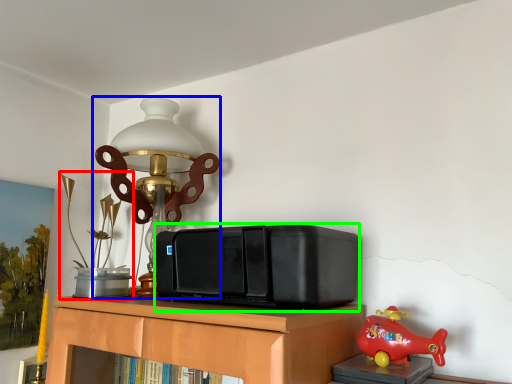
Question: Based on their relative distances, which object is farther from toy (highlighted by a red box)? Choose from lamp (highlighted by a blue box) and stereo (highlighted by a green box).

Choices:
 (A) lamp
 (B) stereo

Answer: (B)